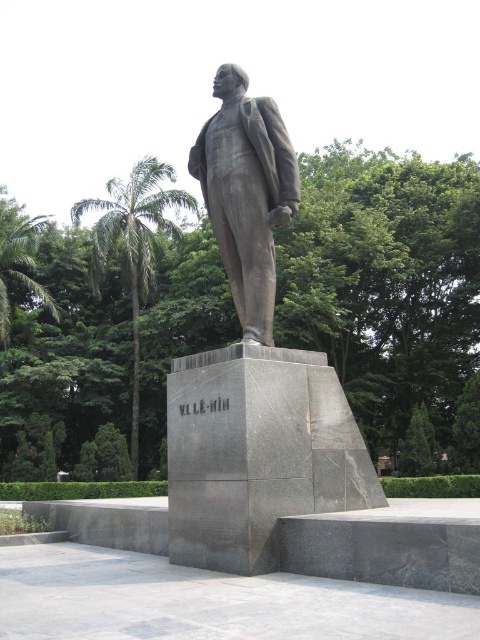
Question: Can you confirm if polished bronze statue at center is wider than bronze statue at center?

Choices:
 (A) no
 (B) yes

Answer: (B)

Question: Can you confirm if polished bronze statue at center is positioned above bronze statue at center?

Choices:
 (A) no
 (B) yes

Answer: (A)

Question: In this image, where is polished bronze statue at center located relative to bronze statue at center?

Choices:
 (A) below
 (B) above

Answer: (A)

Question: Among these points, which one is farthest from the camera?

Choices:
 (A) (239, 124)
 (B) (324, 403)

Answer: (A)

Question: Which of the following is the closest to the observer?

Choices:
 (A) polished bronze statue at center
 (B) bronze statue at center

Answer: (A)